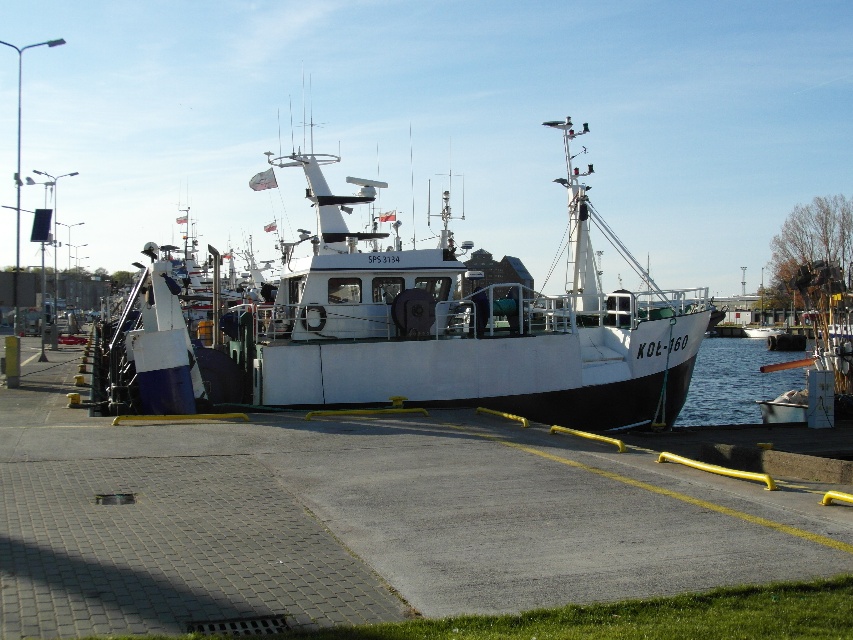
Can you confirm if white matte boat at center is thinner than clear blue water at lower right?

Incorrect, white matte boat at center's width is not less than clear blue water at lower right's.

Where is `white matte boat at center`? The image size is (853, 640). white matte boat at center is located at coordinates (450, 326).

This screenshot has width=853, height=640. Find the location of `white matte boat at center`. white matte boat at center is located at coordinates (450, 326).

Find the location of a particular element. Image resolution: width=853 pixels, height=640 pixels. white matte boat at center is located at coordinates (450, 326).